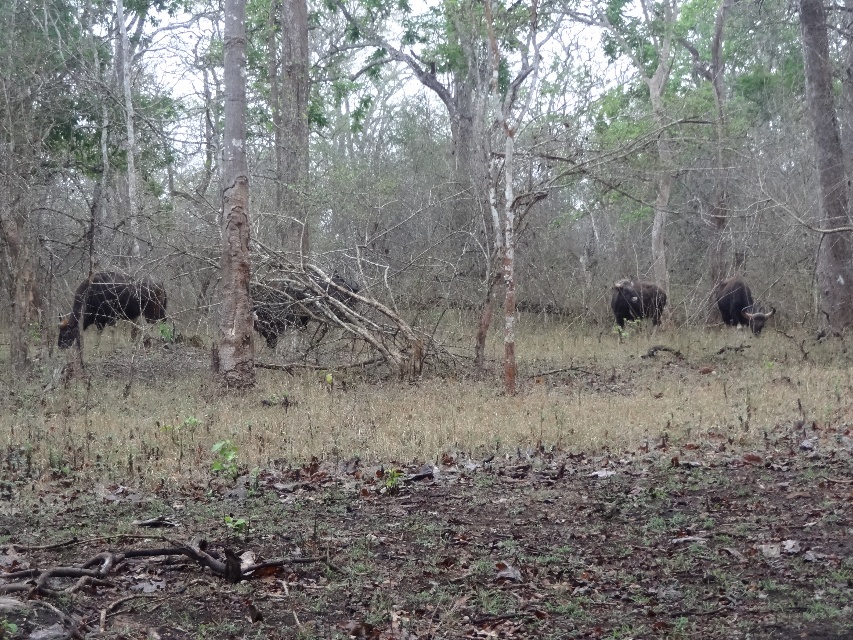
Question: Is black matte cow at center positioned at the back of shiny black buffalo at center?

Choices:
 (A) yes
 (B) no

Answer: (B)

Question: Is brown bark tree at center above brown dry grass at center?

Choices:
 (A) yes
 (B) no

Answer: (A)

Question: Which object is the farthest from the brown dry grass at center?

Choices:
 (A) black matte cow at center
 (B) shiny black buffalo at center
 (C) brown bark tree at center

Answer: (C)

Question: Which point is closer to the camera?

Choices:
 (A) brown dry grass at center
 (B) black matte cow at center

Answer: (A)

Question: Which point is closer to the camera?

Choices:
 (A) (640, 282)
 (B) (833, 218)
 (C) (740, 301)

Answer: (B)

Question: Does shiny black buffalo at left come in front of dark brown textured cow at right?

Choices:
 (A) yes
 (B) no

Answer: (A)